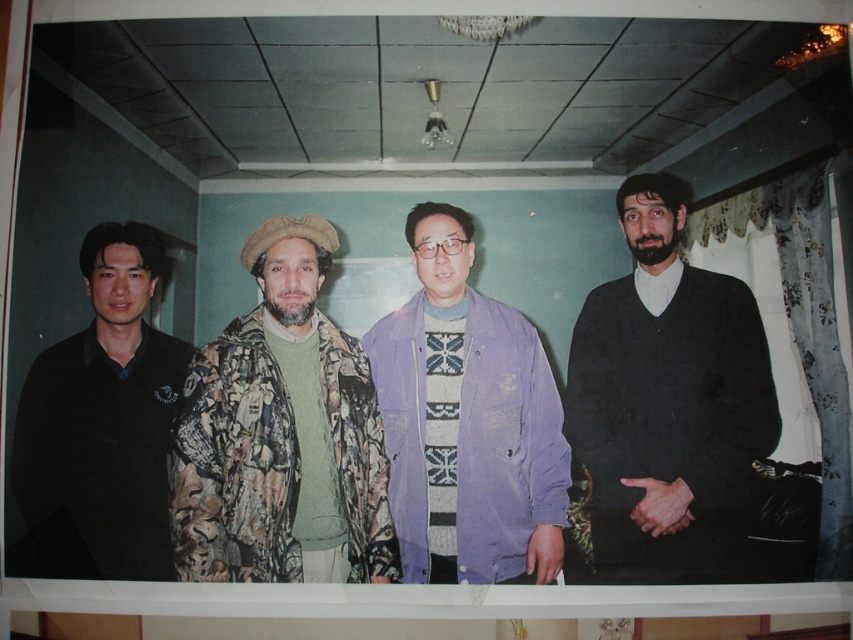
Based on the photo, you are standing in the room and want to hand a document to the person wearing the camouflage jacket at center without approaching the black matte shirt at left. Which direction should you move towards?

The camouflage jacket at center is positioned on the right side of black matte shirt at left, so you should move to the right to reach the camouflage jacket at center without getting closer to the black matte shirt at left.

In the scene shown: You are a photographer setting up a photo shoot in the room described. You need to position a backdrop behind the purple corduroy jacket at center and the black matte shirt at left. Since the backdrop is only 1.8 meters tall, will it be sufficient to cover both subjects without needing to adjust their positions?

The purple corduroy jacket at center is much taller than the black matte shirt at left. Since the backdrop is 1.8 meters tall, it should be sufficient as long as the tallest subject, the purple corduroy jacket at center, is under 1.8 meters in height. However, without specific height measurements, we can only confirm that the backdrop needs to cover up to the height of the taller object, which is the purple corduroy jacket at center.